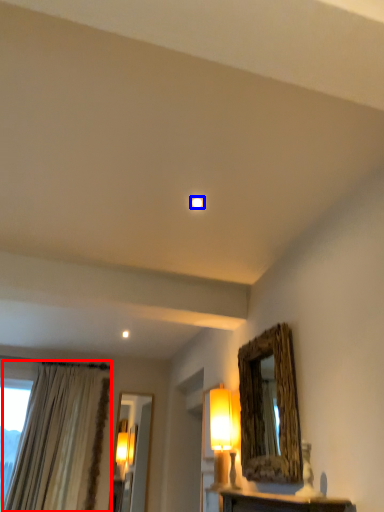
Question: Which object appears closest to the camera in this image, curtain (highlighted by a red box) or lighting (highlighted by a blue box)?

Choices:
 (A) curtain
 (B) lighting

Answer: (B)